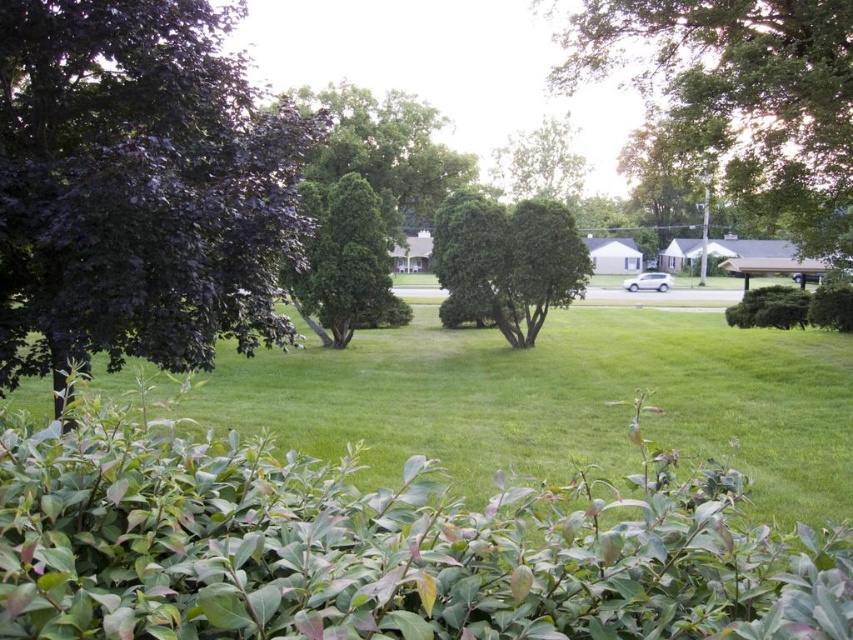
Question: In this image, where is green grass at center located relative to green leafy tree at center?

Choices:
 (A) left
 (B) right

Answer: (B)

Question: Which object is closer to the camera taking this photo?

Choices:
 (A) green leafy bush at center
 (B) green leafy tree at center
 (C) green grass at center

Answer: (C)

Question: Is green leafy tree at upper right above green leafy hedge at right?

Choices:
 (A) yes
 (B) no

Answer: (A)

Question: Is green grass at center bigger than green leafy hedge at right?

Choices:
 (A) yes
 (B) no

Answer: (A)

Question: Which object is the farthest from the green leafy tree at upper center?

Choices:
 (A) green leafy bush at center
 (B) dark purple leafy tree at left

Answer: (B)

Question: Estimate the real-world distances between objects in this image. Which object is farther from the green leafy tree at upper center?

Choices:
 (A) dark purple leafy tree at left
 (B) green leafy tree at upper right
 (C) green leafy tree at center

Answer: (A)